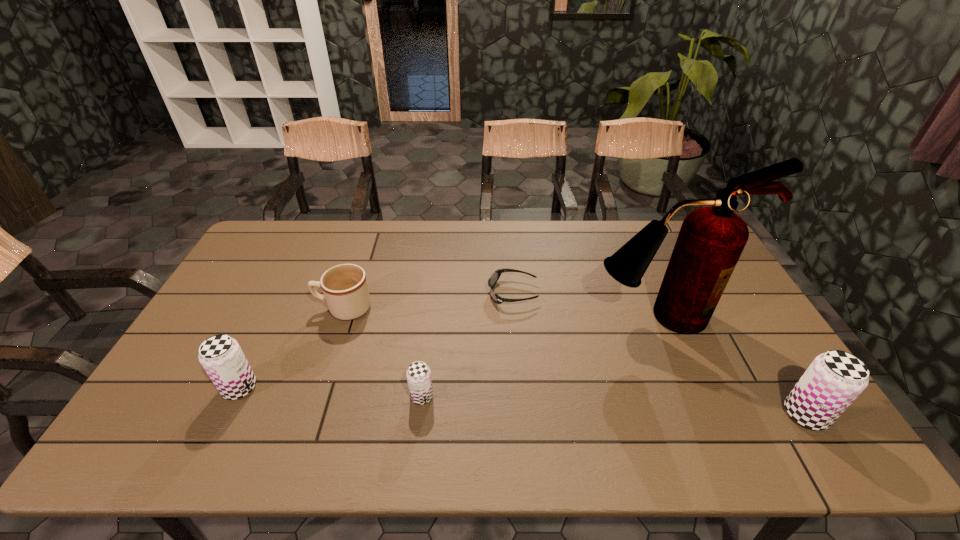
Locate an element on the screen. The width and height of the screenshot is (960, 540). the second shortest beer can is located at coordinates pyautogui.click(x=221, y=356).

Locate an element on the screen. This screenshot has height=540, width=960. the leftmost beer can is located at coordinates (221, 356).

Find the location of `the second beer can from left to right`. the second beer can from left to right is located at coordinates (418, 374).

I want to click on the shortest beer can, so click(418, 374).

Where is `the rightmost beer can`? The height and width of the screenshot is (540, 960). the rightmost beer can is located at coordinates (834, 379).

Locate an element on the screen. The height and width of the screenshot is (540, 960). fire extinguisher is located at coordinates (711, 240).

This screenshot has width=960, height=540. Identify the location of the second object from left to right. click(x=345, y=289).

At what (x,y) coordinates should I click in order to perform the action: click on the fourth object from left to right. Please return your answer as a coordinate pair (x, y). This screenshot has height=540, width=960. Looking at the image, I should click on (495, 276).

This screenshot has height=540, width=960. I want to click on sunglasses, so click(x=495, y=276).

Locate an element on the screen. vacant region located 0.150m on the right of the leftmost object is located at coordinates (315, 388).